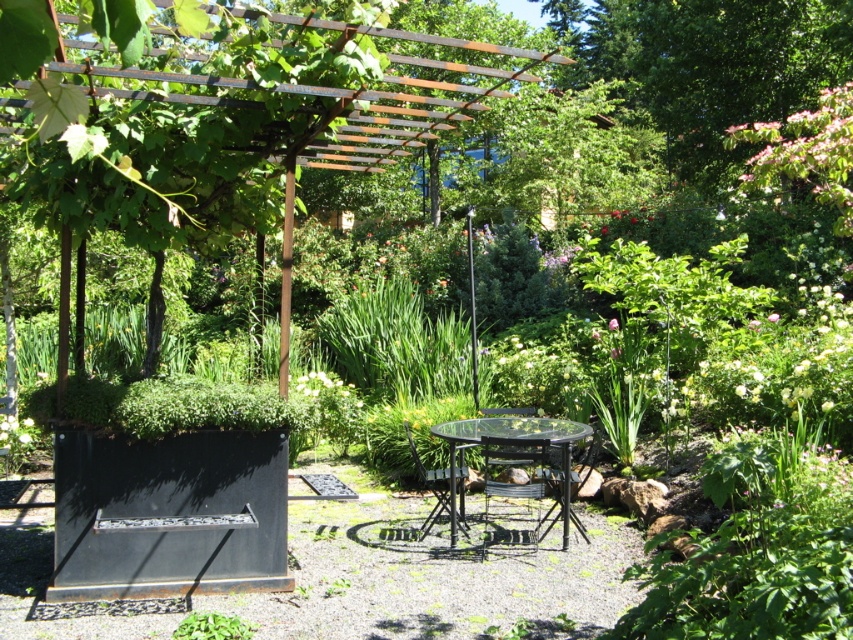
From the picture: You are hosting a garden party and want to seat guests around the transparent glass table at center and the metallic black chair at center. Which object has a larger surface area to accommodate more guests?

The transparent glass table at center has a larger surface area than the metallic black chair at center, so it can accommodate more guests.

You are setting up a small garden party and need to place a 1.2 meter wide decorative mat between the transparent glass table at center and the metallic black chair at center. Can the mat fit between them without overlapping either object?

The transparent glass table at center might be wider than metallic black chair at center, so the 1.2 meter wide decorative mat may or may not fit between them depending on their exact widths. Without knowing the exact dimensions of both objects, it is uncertain if the mat will fit properly.